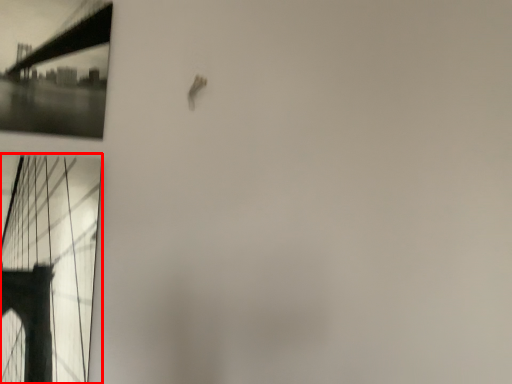
Question: From the image's perspective, where is window (annotated by the red box) located relative to suspension bridge?

Choices:
 (A) above
 (B) below

Answer: (B)